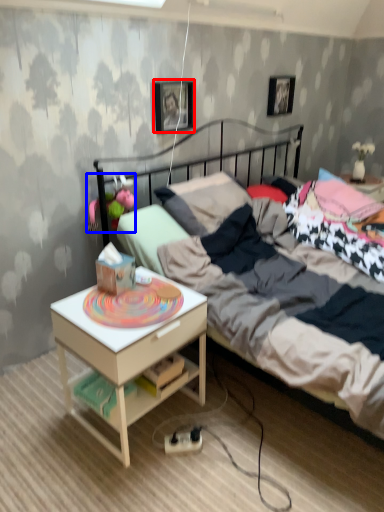
Question: Which of the following is the farthest to the observer, picture frame (highlighted by a red box) or toy (highlighted by a blue box)?

Choices:
 (A) picture frame
 (B) toy

Answer: (A)